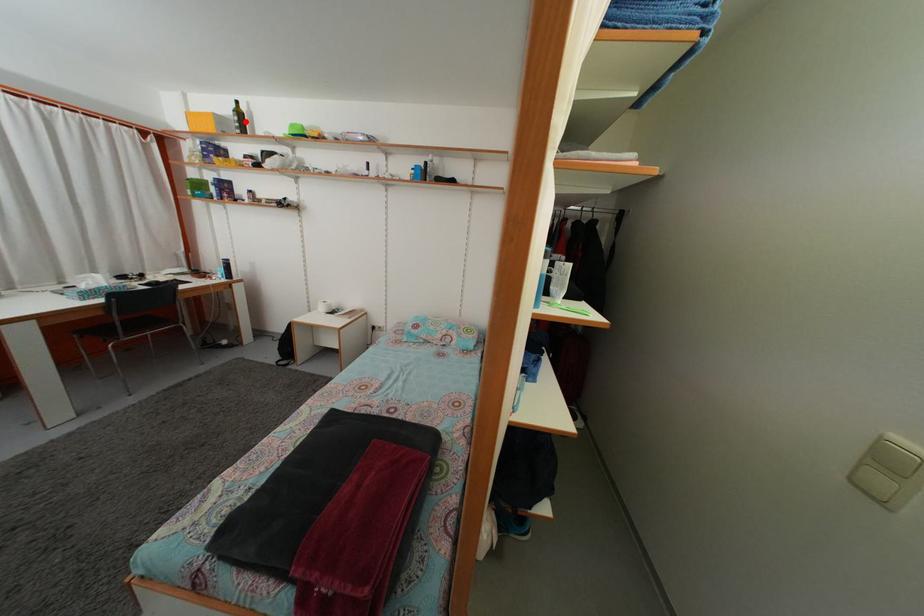
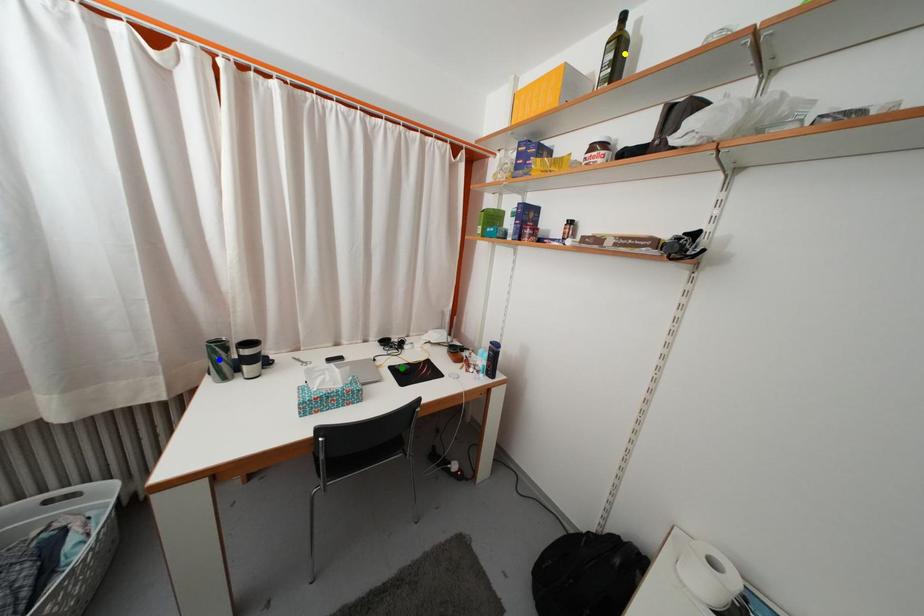
Question: I am providing you with two images of the same scene from different viewpoints. A red point is marked on the first image. You are given multiple points on the second image. Which point in image 2 is actually the same real-world point as the red point in image 1?

Choices:
 (A) blue point
 (B) green point
 (C) yellow point

Answer: (C)